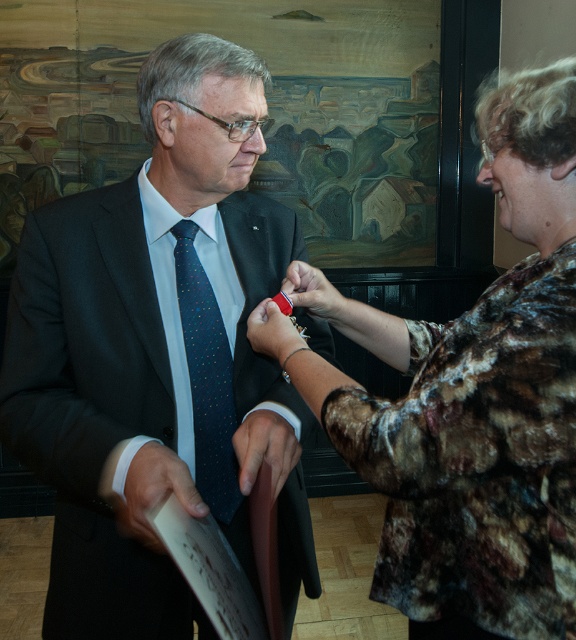
Question: Is matte black suit at center bigger than matte red pin at center?

Choices:
 (A) no
 (B) yes

Answer: (B)

Question: Does matte black suit at center appear on the left side of dark blue silk tie at center?

Choices:
 (A) yes
 (B) no

Answer: (A)

Question: Which point is closer to the camera taking this photo?

Choices:
 (A) (314, 300)
 (B) (240, 448)
 (C) (187, 420)
 (D) (138, 538)

Answer: (B)

Question: Is floral-patterned fabric at center thinner than smooth leather hand at center?

Choices:
 (A) yes
 (B) no

Answer: (B)

Question: Considering the real-world distances, which object is farthest from the dark blue silk tie at center?

Choices:
 (A) matte brown leather at center
 (B) matte black suit at center
 (C) white paper at lower left
 (D) matte red pin at center

Answer: (C)

Question: Which point is farther from the camera taking this photo?

Choices:
 (A) (192, 504)
 (B) (308, 307)
 (C) (397, 339)
 (D) (290, 625)

Answer: (D)